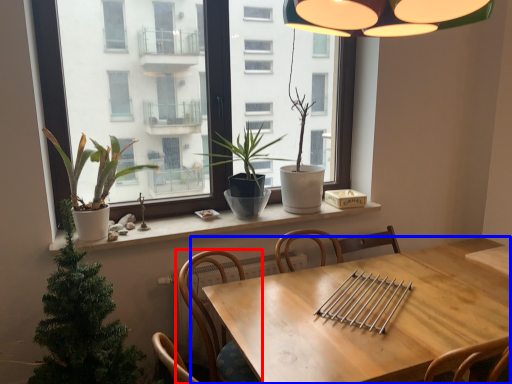
Question: Which object appears farthest to the camera in this image, chair (highlighted by a red box) or table (highlighted by a blue box)?

Choices:
 (A) chair
 (B) table

Answer: (A)